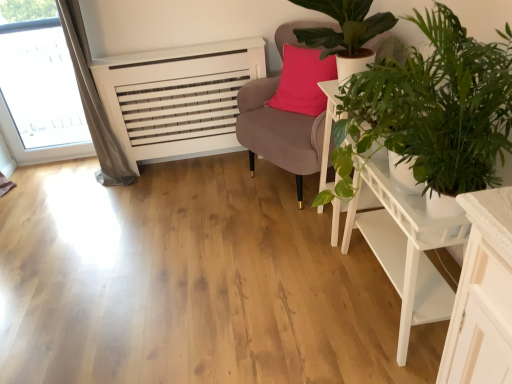
This screenshot has width=512, height=384. What are the coordinates of `free space in front of velvet pink chair at upper right` in the screenshot? It's located at (267, 256).